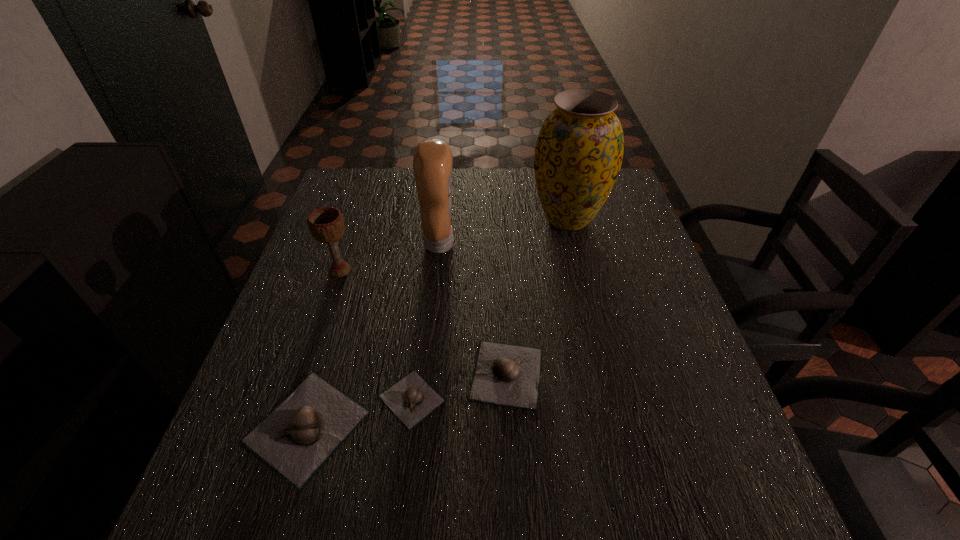
You are a GUI agent. You are given a task and a screenshot of the screen. Output one action in this format:
    pyautogui.click(x=<x>, y=<y>)
    Task: Click on the vacant space positioned 0.250m on the right of the shortest garlic
    
    Given the screenshot: What is the action you would take?
    pyautogui.click(x=576, y=399)

Image resolution: width=960 pixels, height=540 pixels. Find the location of `blank area located 0.130m on the right of the rightmost garlic`. blank area located 0.130m on the right of the rightmost garlic is located at coordinates (610, 374).

The image size is (960, 540). In order to click on vacant space located 0.380m on the label of the fifth shortest object in this screenshot , I will do `click(597, 243)`.

You are a GUI agent. You are given a task and a screenshot of the screen. Output one action in this format:
    pyautogui.click(x=<x>, y=<y>)
    Task: Click on the free space located on the left of the tallest object
    This screenshot has height=540, width=960.
    Given the screenshot: What is the action you would take?
    pyautogui.click(x=432, y=219)

I want to click on free space located on the front of the third tallest object, so click(331, 296).

You are a GUI agent. You are given a task and a screenshot of the screen. Output one action in this format:
    pyautogui.click(x=<x>, y=<y>)
    Task: Click on the object that is positioned at the far edge
    
    Given the screenshot: What is the action you would take?
    pyautogui.click(x=579, y=151)

Where is `garlic at the left edge`? garlic at the left edge is located at coordinates (298, 437).

You are a GUI agent. You are given a task and a screenshot of the screen. Output one action in this format:
    pyautogui.click(x=<x>, y=<y>)
    Task: Click on the chalice at the left edge
    
    Given the screenshot: What is the action you would take?
    pyautogui.click(x=326, y=224)

Locate an element on the screen. Image resolution: width=960 pixels, height=540 pixels. object that is positioned at the right edge is located at coordinates (579, 151).

Locate an element on the screen. This screenshot has height=540, width=960. object that is at the near left corner is located at coordinates (298, 437).